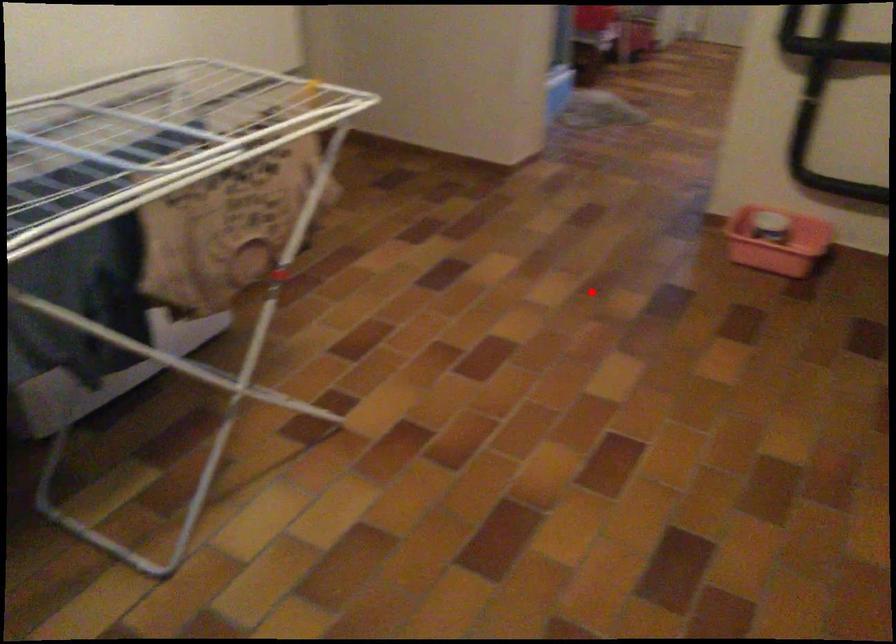
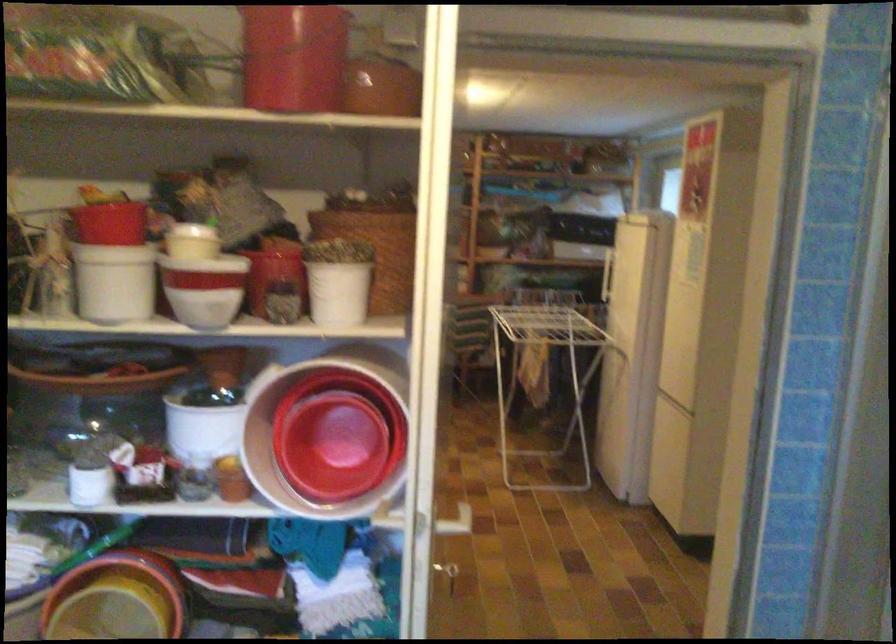
Question: I am providing you with two images of the same scene from different viewpoints. In image1, a red point is highlighted. Considering the same 3D point in image2, which of the following is correct?

Choices:
 (A) It is closer
 (B) It is farther

Answer: (B)